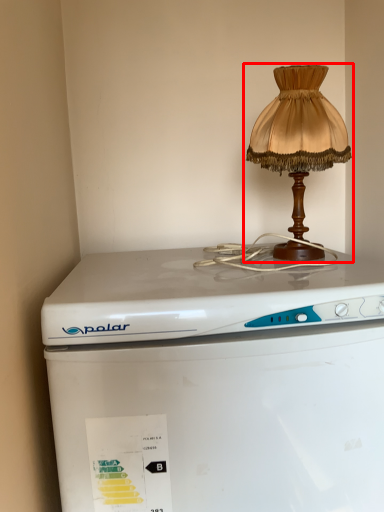
Question: From the image's perspective, what is the correct spatial relationship of lamp (annotated by the red box) in relation to home appliance?

Choices:
 (A) below
 (B) above

Answer: (B)